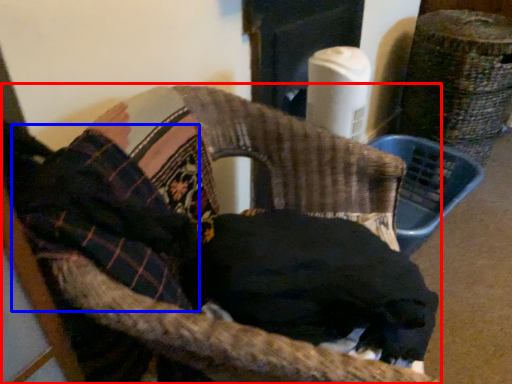
Question: Which point is further to the camera, chair (highlighted by a red box) or clothing (highlighted by a blue box)?

Choices:
 (A) chair
 (B) clothing

Answer: (B)